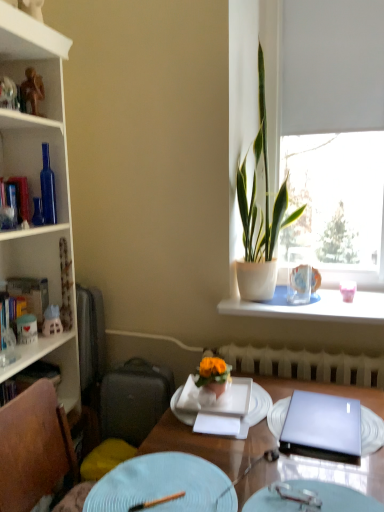
At what (x,y) coordinates should I click in order to perform the action: click on vacant space situated above light blue ceramic plate at center, which is the 2th plate from back to front (from a real-world perspective). Please return your answer as a coordinate pair (x, y). Looking at the image, I should click on (156, 484).